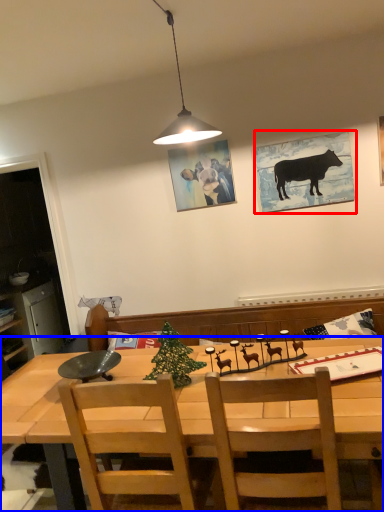
Question: Which point is further to the camera, picture frame (highlighted by a red box) or desk (highlighted by a blue box)?

Choices:
 (A) picture frame
 (B) desk

Answer: (A)